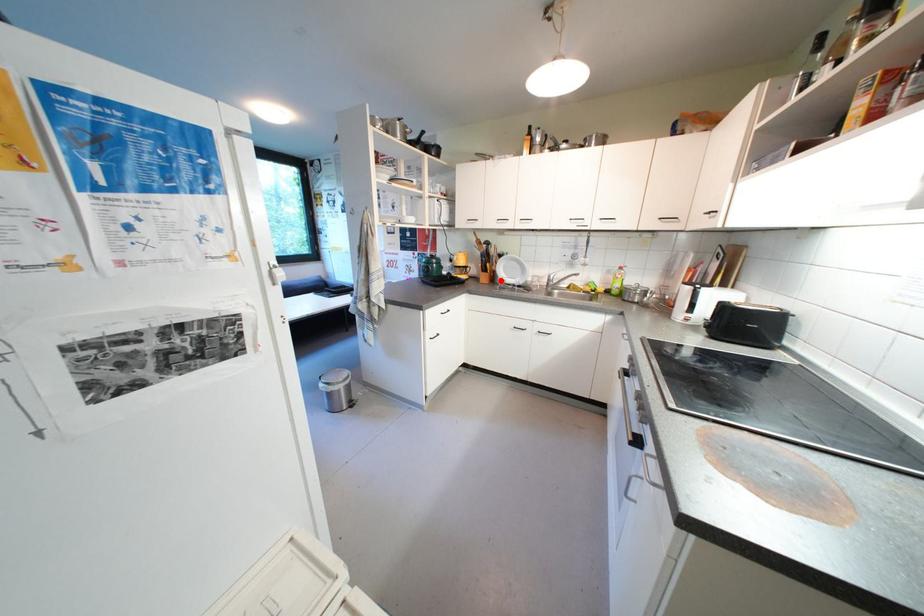
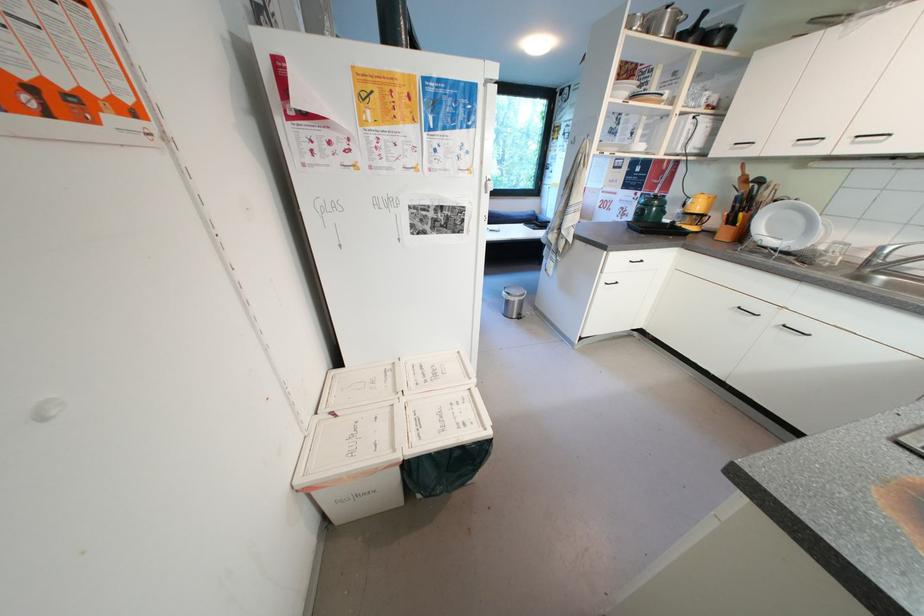
Locate, in the second image, the point that corresponds to the highlighted location in the first image.

(749, 238)